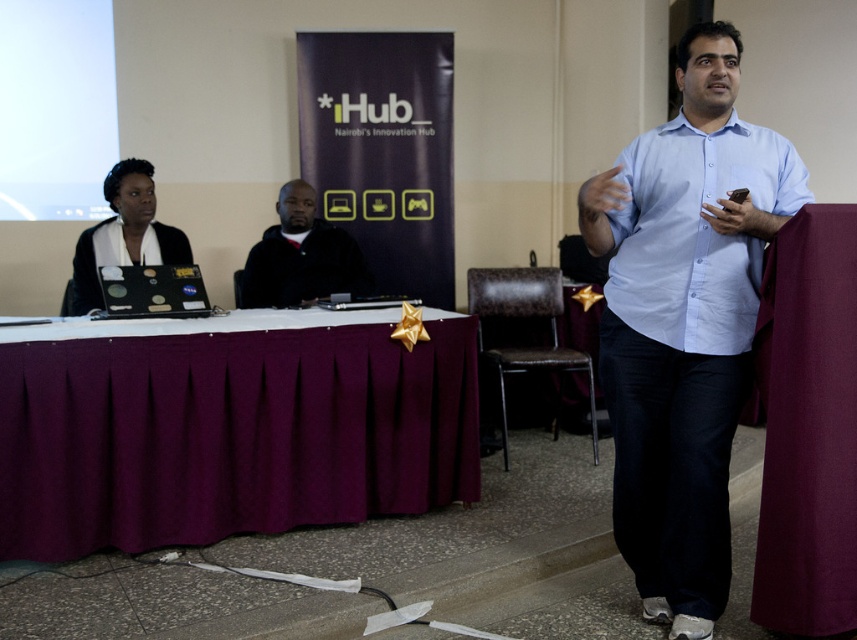
You are a photographer at the event and need to adjust the lighting so that the light blue button down shirt at center is well lit. The light is currently at point (684, 323). Is the light positioned correctly to illuminate the light blue button down shirt at center?

The light blue button down shirt at center is located at point (684, 323), so yes, the light is positioned correctly to illuminate the light blue button down shirt at center.